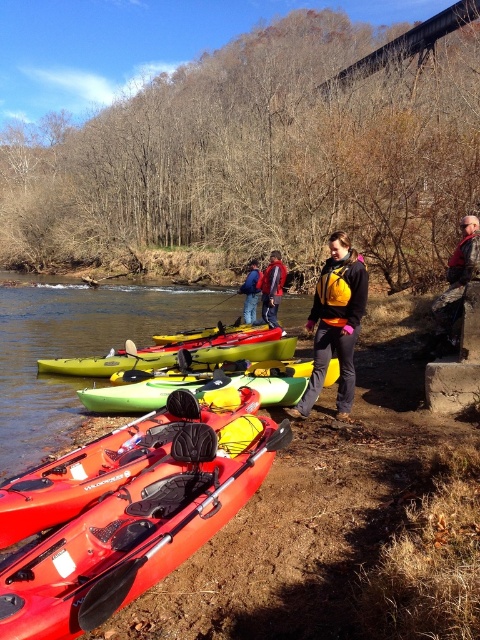
You are a safety inspector checking the equipment for the kayaking group. You notice the yellow life vest at center and the black rubber paddle at lower left. Which item is taller?

The yellow life vest at center is much taller than the black rubber paddle at lower left.

Consider the image. You are a safety inspector checking the kayaking setup. You notice two items at the center of the scene. One is the yellow life vest at center and the other is the matte blue jacket at center. According to safety regulations, life vests must be placed to the left of any jackets to ensure quick access. Is the current arrangement compliant with this rule?

The yellow life vest at center is to the right of the matte blue jacket at center. Since the life vest needs to be to the left of the jacket for quick access, the current arrangement is not compliant with the safety regulations.